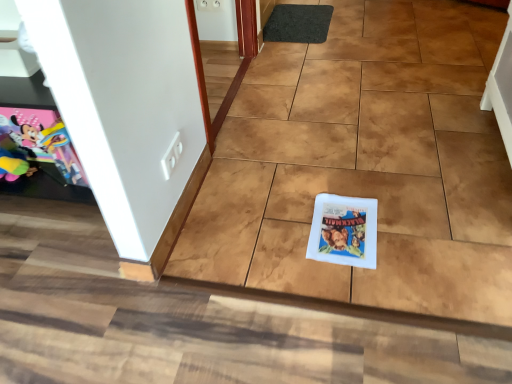
Image resolution: width=512 pixels, height=384 pixels. In order to click on vacant space positioned to the left of white paper comic book at center, which is the second comic book from top to bottom in this screenshot , I will do `click(281, 235)`.